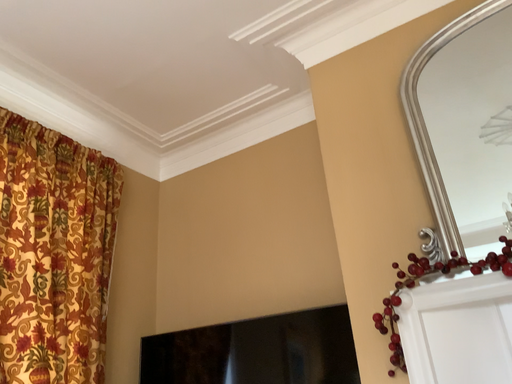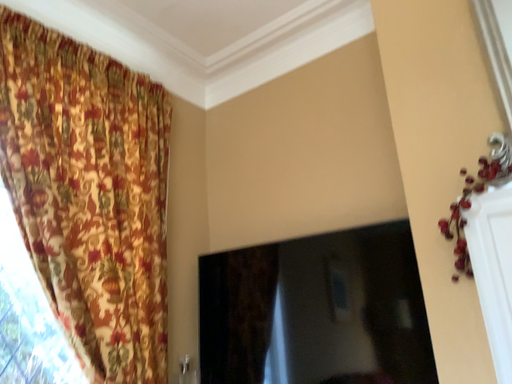
Question: How did the camera likely rotate when shooting the video?

Choices:
 (A) rotated upward
 (B) rotated downward

Answer: (B)